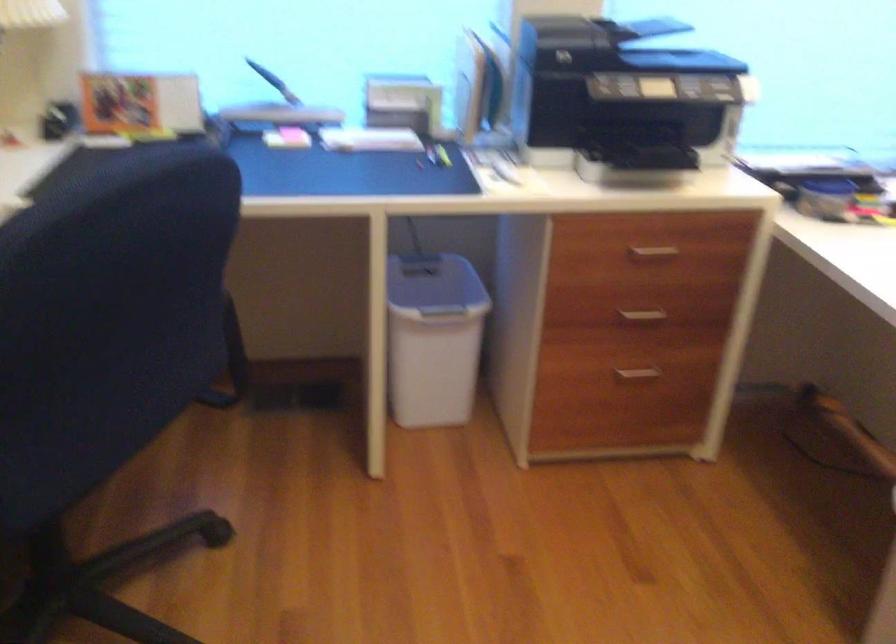
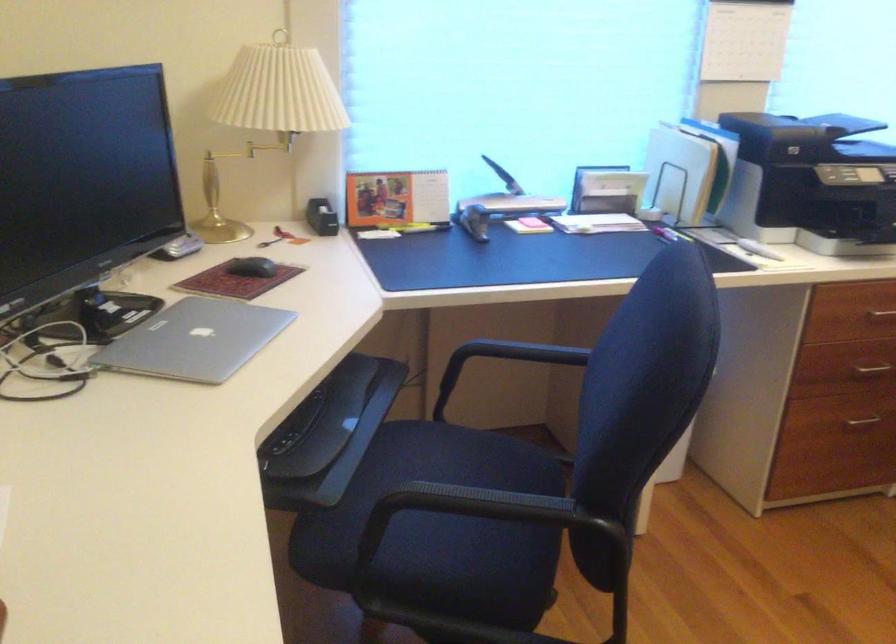
Where in the second image is the point corresponding to point 645,252 from the first image?

(881, 315)